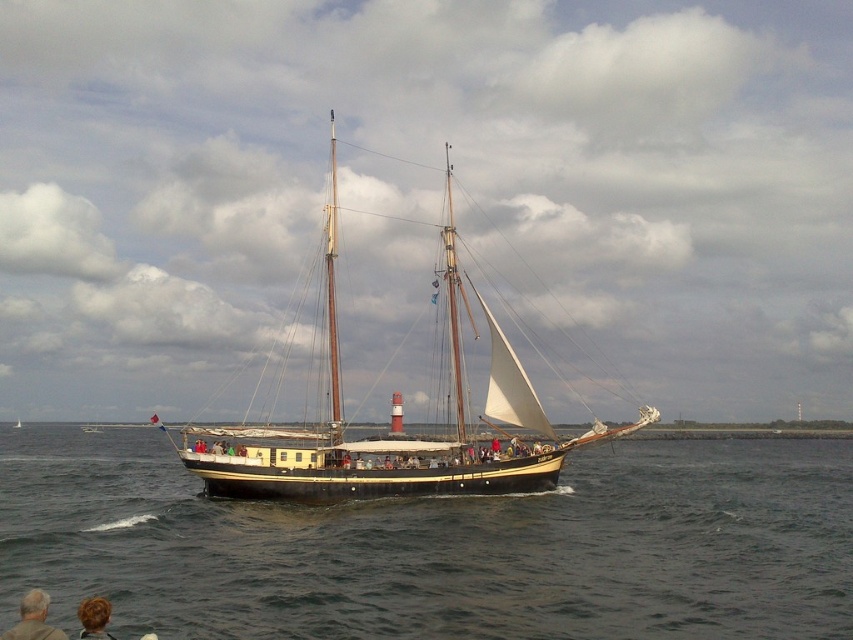
Question: Can you confirm if dark blue water at center is bigger than wooden mast at center?

Choices:
 (A) yes
 (B) no

Answer: (A)

Question: From the image, what is the correct spatial relationship of dark blue water at center in relation to wooden sailboat at center?

Choices:
 (A) left
 (B) right

Answer: (A)

Question: Which point is closer to the camera?

Choices:
 (A) (445, 564)
 (B) (338, 438)

Answer: (A)

Question: Which point is closer to the camera?

Choices:
 (A) (328, 360)
 (B) (351, 589)
 (C) (44, 609)
 (D) (265, 451)

Answer: (C)

Question: Does wooden sailboat at center have a larger size compared to wooden mast at center?

Choices:
 (A) no
 (B) yes

Answer: (B)

Question: Among these points, which one is farthest from the camera?

Choices:
 (A) (x=332, y=301)
 (B) (x=39, y=588)
 (C) (x=469, y=449)
 (D) (x=817, y=595)

Answer: (A)